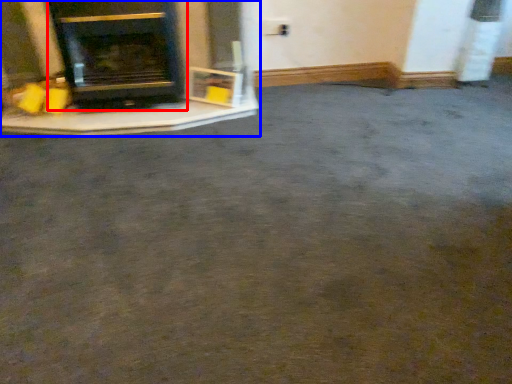
Question: Among these objects, which one is nearest to the camera, wood burning stove (highlighted by a red box) or fireplace (highlighted by a blue box)?

Choices:
 (A) wood burning stove
 (B) fireplace

Answer: (A)